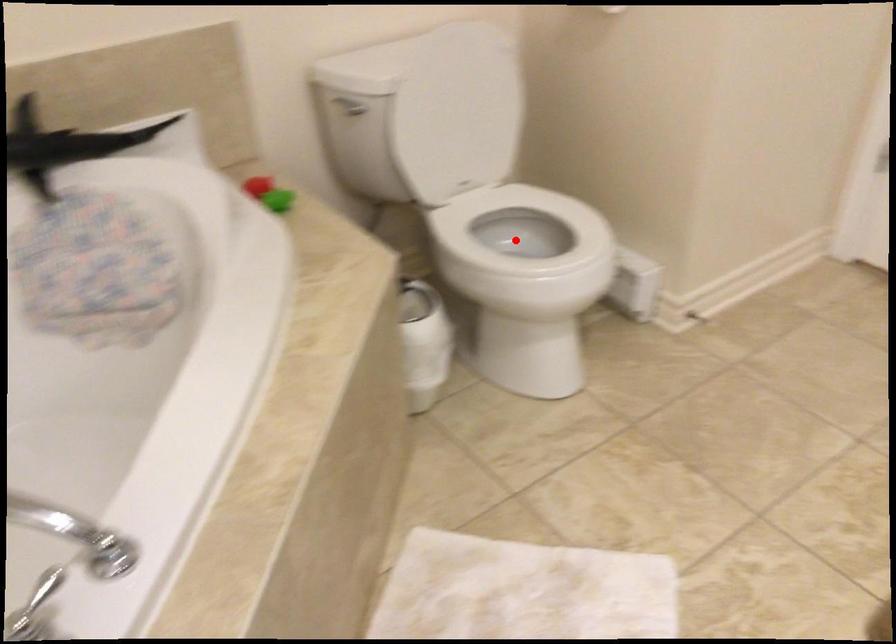
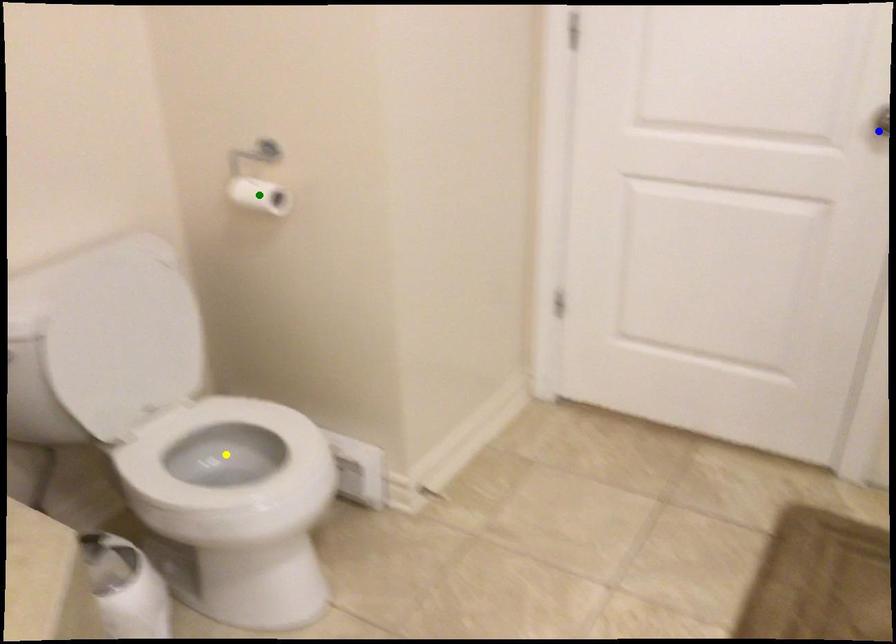
Question: I am providing you with two images of the same scene from different viewpoints. A red point is marked on the first image. You are given multiple points on the second image. Which spot in image 2 lines up with the point in image 1?

Choices:
 (A) green point
 (B) blue point
 (C) yellow point

Answer: (C)